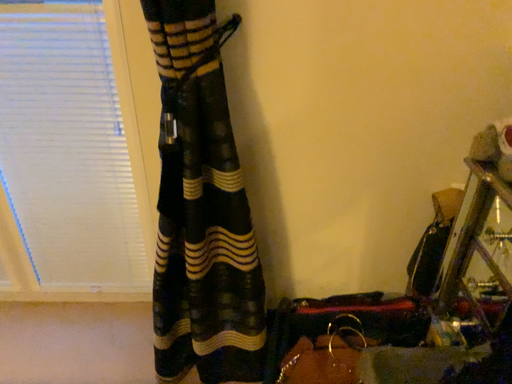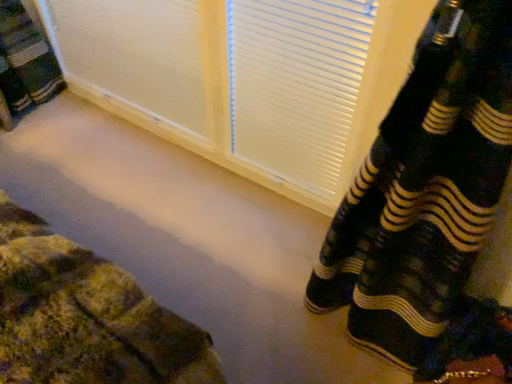
Question: Which way did the camera rotate in the video?

Choices:
 (A) rotated right
 (B) rotated left

Answer: (B)